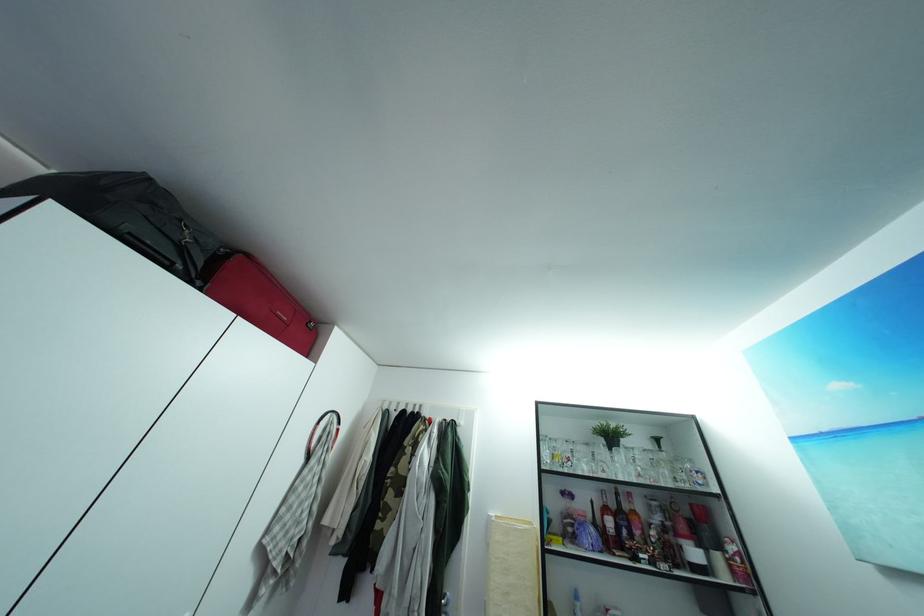
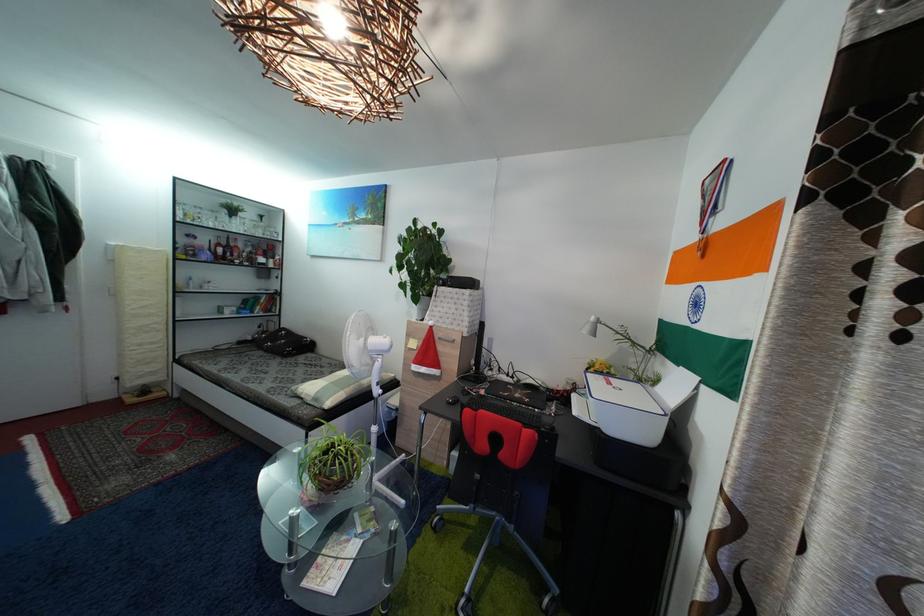
In the second image, find the point that corresponds to point 621,513 in the first image.

(233, 251)